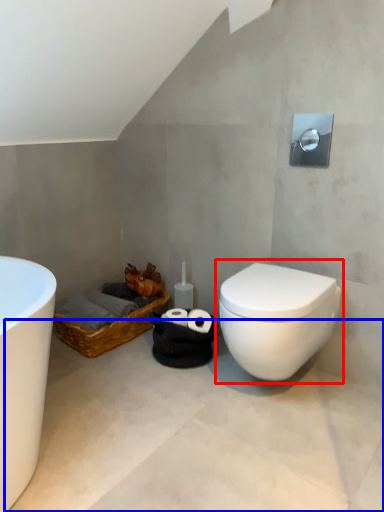
Question: Among these objects, which one is nearest to the camera, toilet (highlighted by a red box) or concrete (highlighted by a blue box)?

Choices:
 (A) toilet
 (B) concrete

Answer: (B)